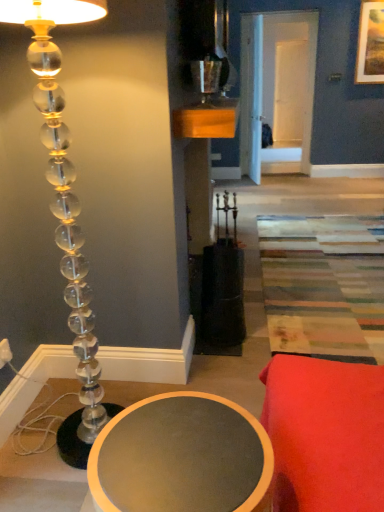
You are a GUI agent. You are given a task and a screenshot of the screen. Output one action in this format:
    pyautogui.click(x=<x>, y=<y>)
    Task: Click on the empty space that is ontop of matte gray table at lower left (from a real-world perspective)
    
    Given the screenshot: What is the action you would take?
    pyautogui.click(x=185, y=450)